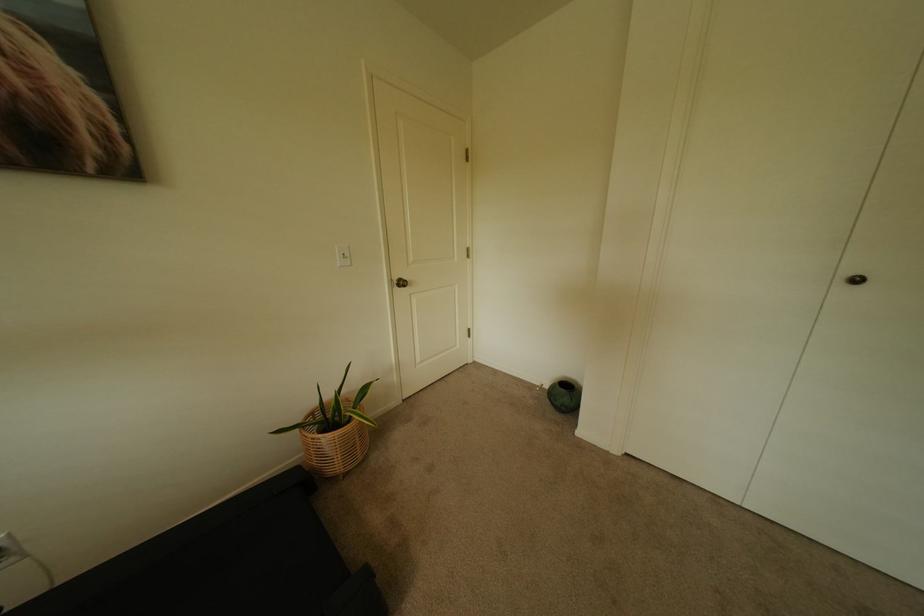
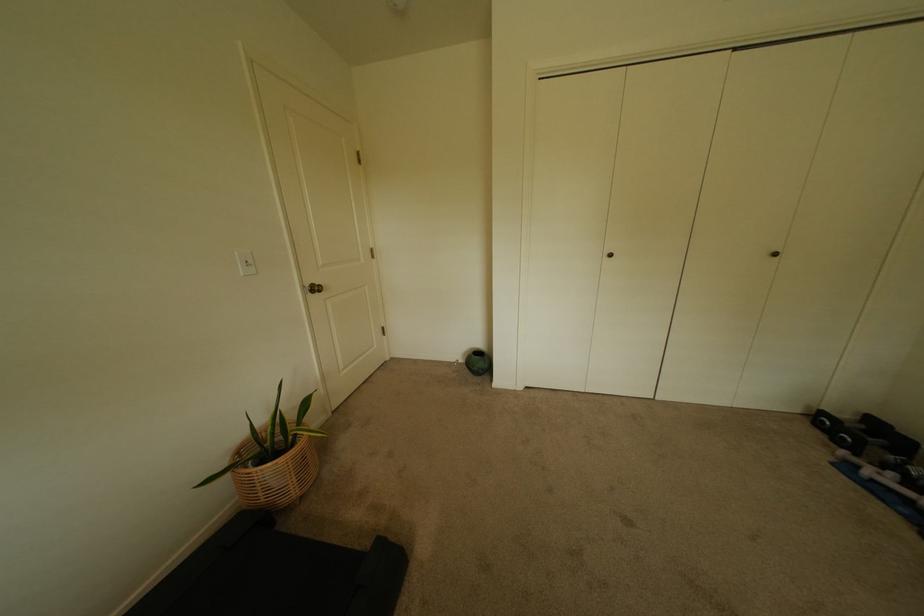
Locate, in the second image, the point that corresponds to point 403,280 in the first image.

(315, 286)